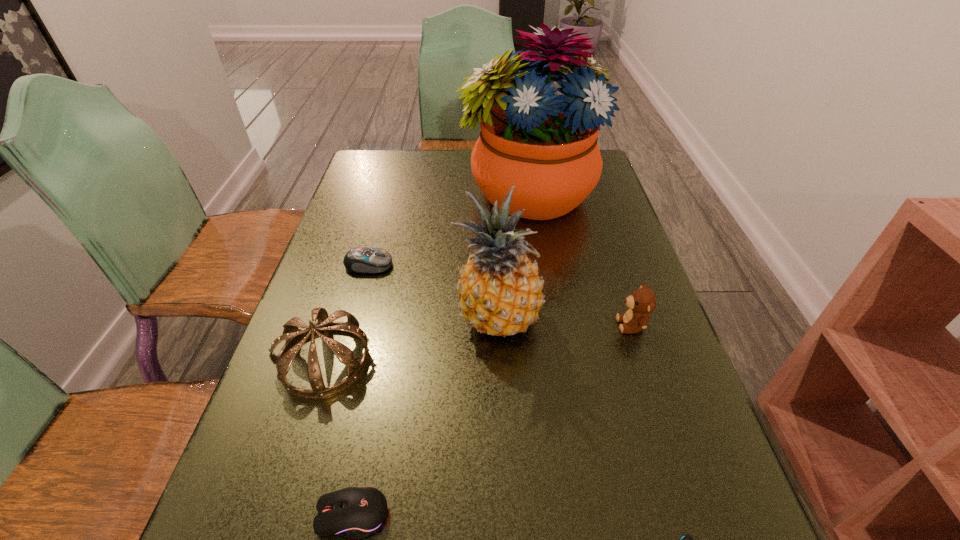
Where is `vacant space that satisfies the following two spatial constraints: 1. on the wheel side of the farthest mouse; 2. on the left side of the pineapple`? vacant space that satisfies the following two spatial constraints: 1. on the wheel side of the farthest mouse; 2. on the left side of the pineapple is located at coordinates (353, 319).

Locate an element on the screen. This screenshot has width=960, height=540. free space in the image that satisfies the following two spatial constraints: 1. on the wheel side of the second farthest object; 2. on the back side of the pineapple is located at coordinates (353, 319).